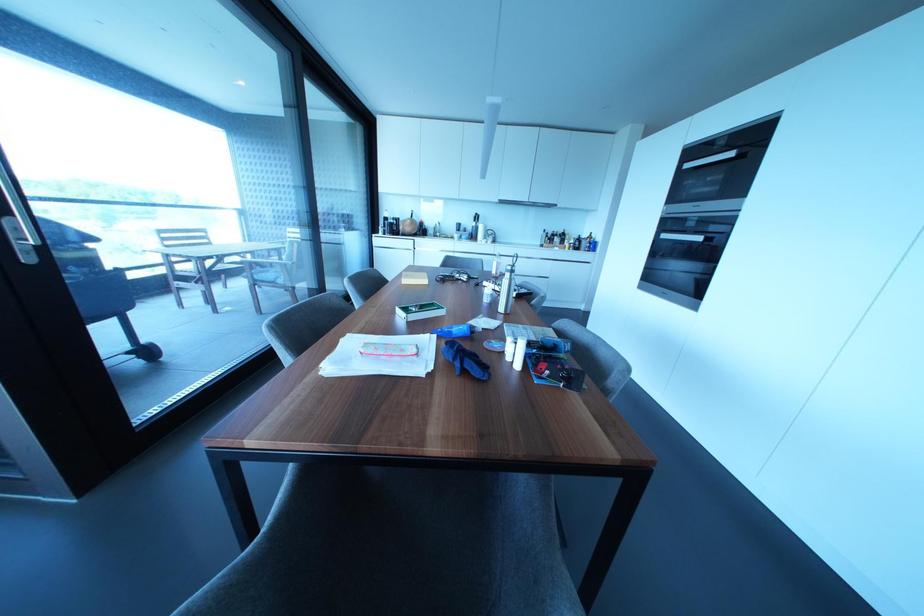
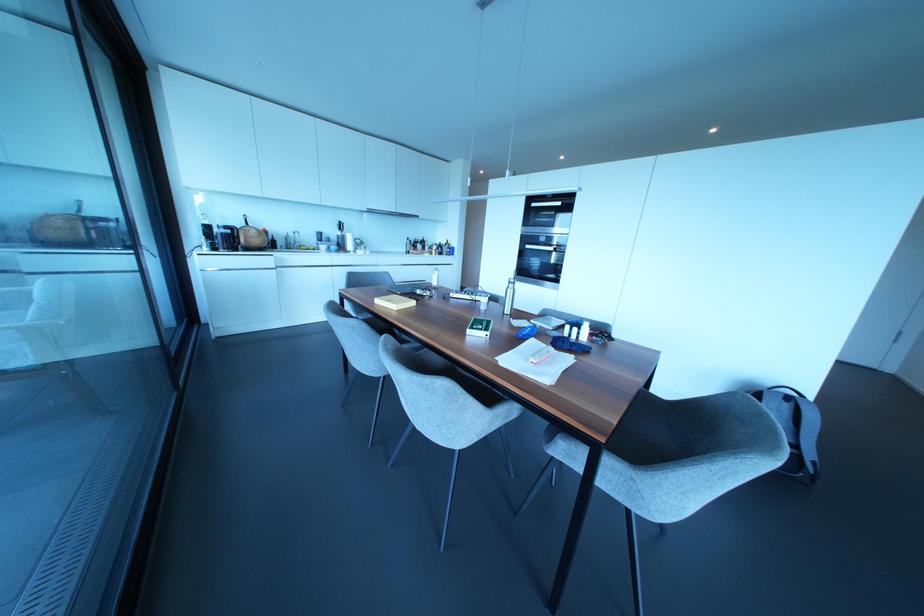
The point at (501, 308) is marked in the first image. Where is the corresponding point in the second image?

(506, 310)